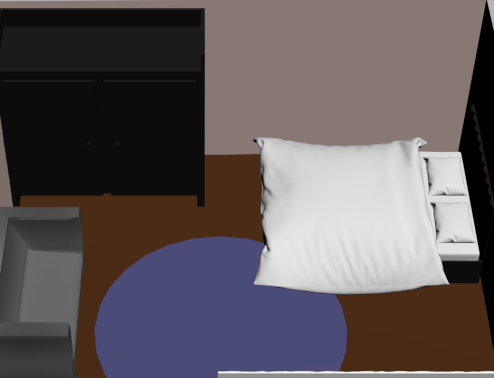
Where is `back wall`? back wall is located at coordinates (486, 109).